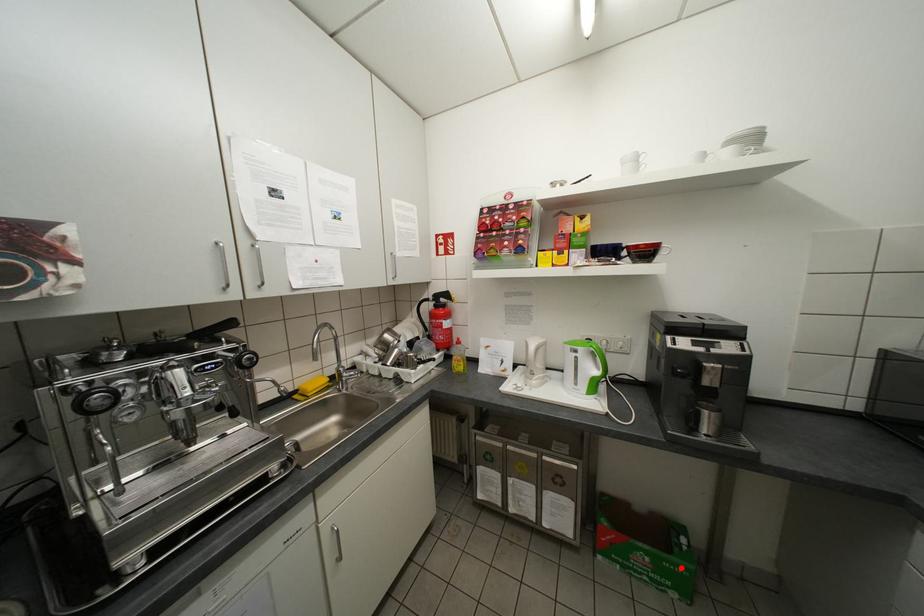
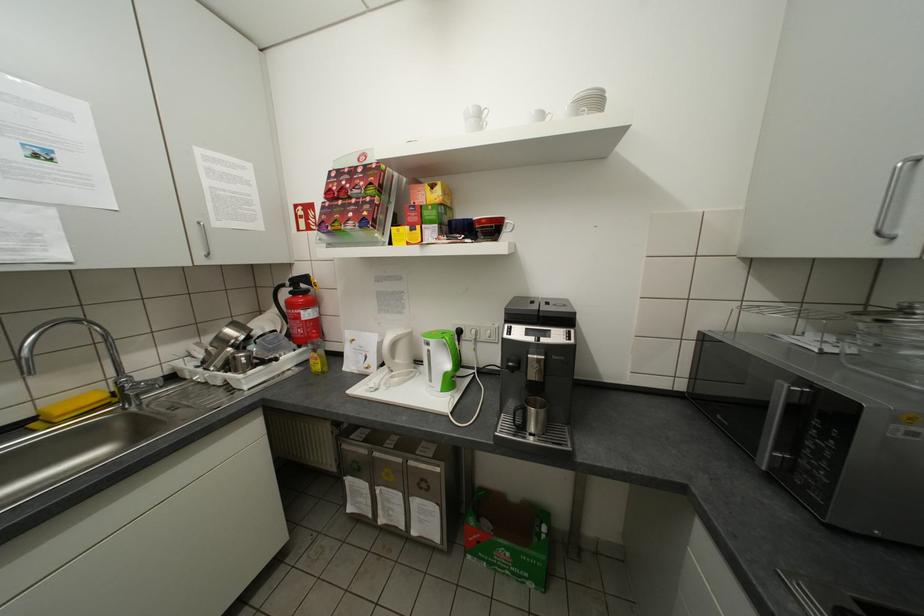
Where in the second image is the point corresponding to the highlighted location from the first image?

(537, 560)